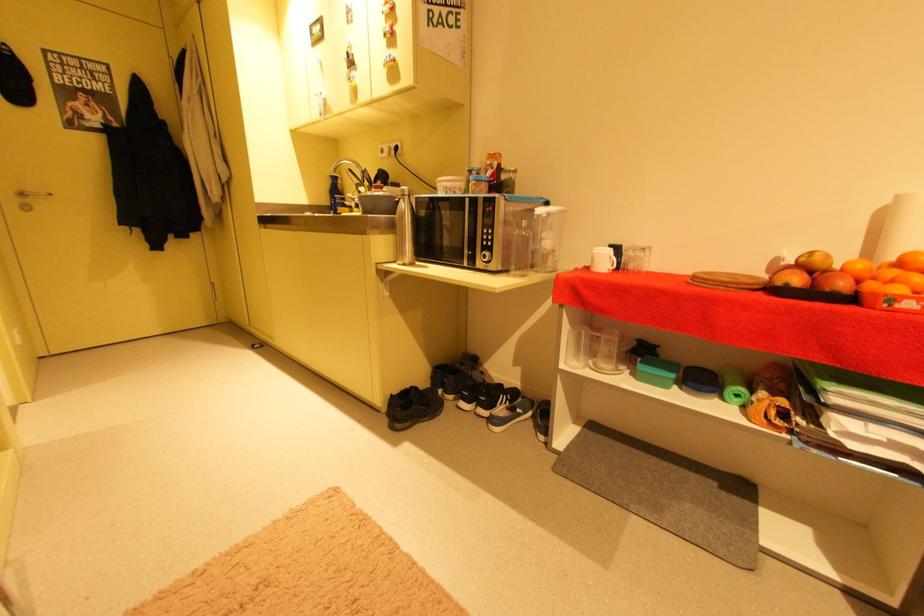
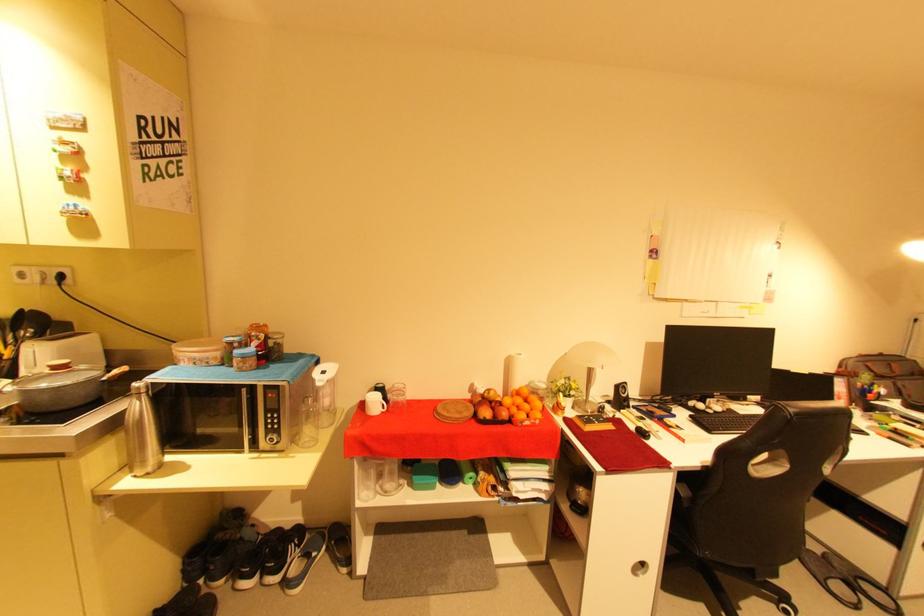
The point at (481, 188) is marked in the first image. Where is the corresponding point in the second image?

(249, 365)